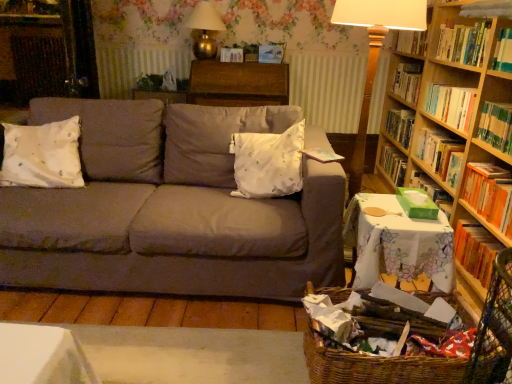
Question: Looking at their shapes, would you say hardcover book at right, which is counted as the 4th book, starting from the top, is wider or thinner than hardwood bookshelf at upper right?

Choices:
 (A) thin
 (B) wide

Answer: (A)

Question: Is hardcover book at right, which ranks as the first book in bottom-to-top order, bigger or smaller than hardwood bookshelf at upper right?

Choices:
 (A) big
 (B) small

Answer: (B)

Question: Which is nearer to the wooden bookcase at right?

Choices:
 (A) orange hardcover book at right, the 2th book when ordered from bottom to top
 (B) wooden table at center, the 2th table positioned from the right
 (C) white satin pillow at center, arranged as the second pillow when viewed from the left
 (D) wooden table lamp at right, arranged as the first table lamp when ordered from the bottom
 (E) hardwood bookshelf at upper right

Answer: (E)

Question: Which of these objects is positioned farthest from the white floral tablecloth at lower right, the 1th table in the bottom-to-top sequence?

Choices:
 (A) hardcover book at right, which ranks as the first book in bottom-to-top order
 (B) white satin pillow at center, arranged as the second pillow when viewed from the left
 (C) white satin pillow at left, the second pillow from the right
 (D) wooden bookcase at right
 (E) hardwood bookshelf at upper right

Answer: (C)